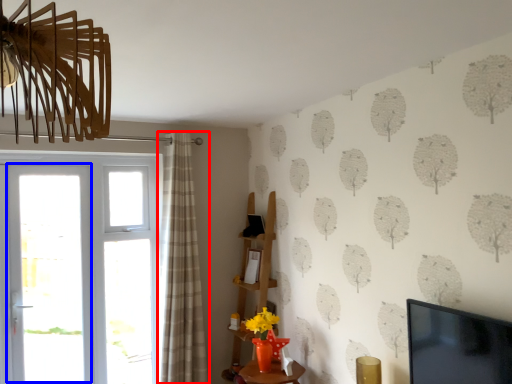
Question: Which of the following is the closest to the observer, curtain (highlighted by a red box) or screen door (highlighted by a blue box)?

Choices:
 (A) curtain
 (B) screen door

Answer: (A)